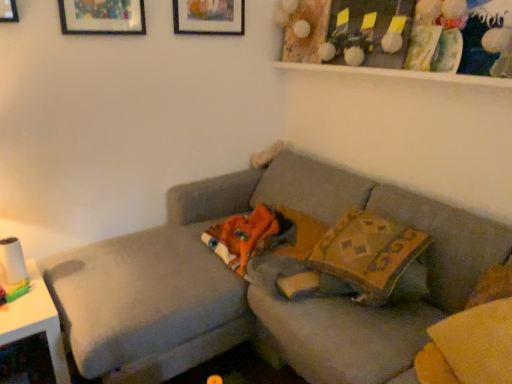
This screenshot has height=384, width=512. In order to click on vacant point above white glossy table at left (from a real-world perspective) in this screenshot , I will do `click(14, 290)`.